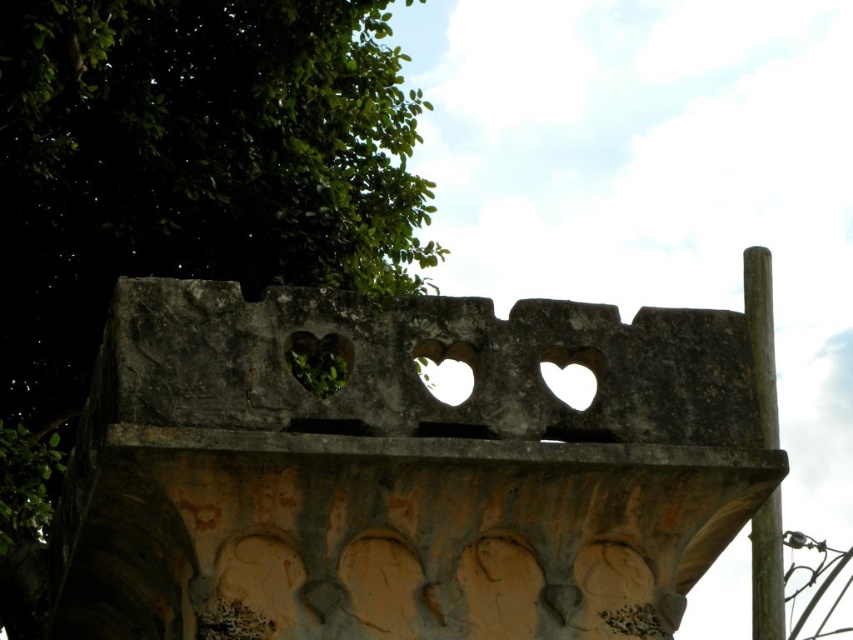
You are a landscape architect designing a garden path that needs to pass between the gray stone heart holes at center and the green leafy tree at upper left. Given the distance between them, what is the minimum width the path should be to allow a standard garden cart to pass through comfortably?

The gray stone heart holes at center and green leafy tree at upper left are 26.16 meters apart. A standard garden cart typically requires a path width of at least 1.2 meters. Since the distance between the two objects is much larger than this requirement, the path can easily accommodate the cart without any issues.

From the picture: You are an architect analyzing the structure. The gray stone heart holes at center and the green leafy tree at upper left are both visible in the image. Which object has a greater width?

The gray stone heart holes at center has a greater width than the green leafy tree at upper left according to the description.

You are a photographer standing in front of the architectural structure. You notice the green leafy tree at upper left and the brown wood pole at right. Which object is positioned higher in the image?

The green leafy tree at upper left is positioned higher than the brown wood pole at right according to the description.